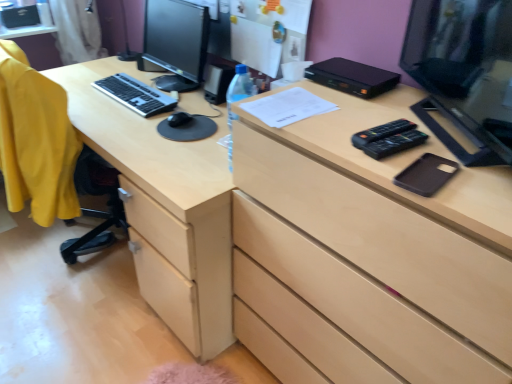
Question: Looking at the image, does light wood desk at center seem bigger or smaller compared to black glossy monitor at upper right, the second computer monitor positioned from the back?

Choices:
 (A) small
 (B) big

Answer: (B)

Question: From their relative heights in the image, would you say light wood desk at center is taller or shorter than black glossy monitor at upper right, which is counted as the 2th computer monitor, starting from the left?

Choices:
 (A) short
 (B) tall

Answer: (B)

Question: Which of these objects is positioned farthest from the black glossy monitor at upper right, which is counted as the 2th computer monitor, starting from the left?

Choices:
 (A) black plastic printer at upper center
 (B) yellow fabric computer chair at left
 (C) light wood desk at center
 (D) black matte phone case at right
 (E) black matte mouse at center

Answer: (B)

Question: Considering the real-world distances, which object is closest to the matte black monitor at center left, marked as the second computer monitor in a right-to-left arrangement?

Choices:
 (A) black plastic printer at upper center
 (B) light wood chest of drawers at center
 (C) white paper at center
 (D) light wood desk at center
 (E) yellow fabric computer chair at left

Answer: (D)